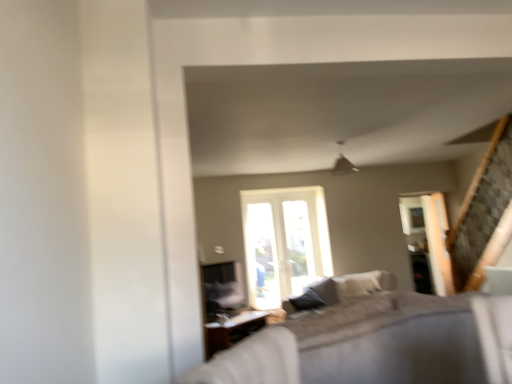
Question: Could wooden table at lower center be considered to be inside textured beige couch at center?

Choices:
 (A) no
 (B) yes

Answer: (A)

Question: Can you confirm if textured beige couch at center is wider than wooden table at lower center?

Choices:
 (A) yes
 (B) no

Answer: (A)

Question: Is the depth of textured beige couch at center greater than that of wooden table at lower center?

Choices:
 (A) no
 (B) yes

Answer: (A)

Question: Considering the relative sizes of textured beige couch at center and wooden table at lower center in the image provided, is textured beige couch at center smaller than wooden table at lower center?

Choices:
 (A) no
 (B) yes

Answer: (A)

Question: From a real-world perspective, is textured beige couch at center physically above wooden table at lower center?

Choices:
 (A) yes
 (B) no

Answer: (A)

Question: Choose the correct answer: Is clear glass screen door at right inside textured beige couch at center or outside it?

Choices:
 (A) outside
 (B) inside

Answer: (A)

Question: From a real-world perspective, relative to textured beige couch at center, is clear glass screen door at right vertically above or below?

Choices:
 (A) below
 (B) above

Answer: (B)

Question: Is clear glass screen door at right taller or shorter than textured beige couch at center?

Choices:
 (A) short
 (B) tall

Answer: (B)

Question: Considering their positions, is clear glass screen door at right located in front of or behind textured beige couch at center?

Choices:
 (A) front
 (B) behind

Answer: (B)

Question: Is point (440, 200) positioned closer to the camera than point (228, 339)?

Choices:
 (A) closer
 (B) farther

Answer: (B)

Question: From the image's perspective, is clear glass screen door at right above or below wooden table at lower center?

Choices:
 (A) above
 (B) below

Answer: (A)

Question: From a real-world perspective, is clear glass screen door at right above or below wooden table at lower center?

Choices:
 (A) below
 (B) above

Answer: (B)

Question: Is clear glass screen door at right taller or shorter than wooden table at lower center?

Choices:
 (A) tall
 (B) short

Answer: (A)

Question: From the image's perspective, is wooden table at lower center above or below clear glass screen door at right?

Choices:
 (A) above
 (B) below

Answer: (B)

Question: Is wooden table at lower center taller or shorter than clear glass screen door at right?

Choices:
 (A) tall
 (B) short

Answer: (B)